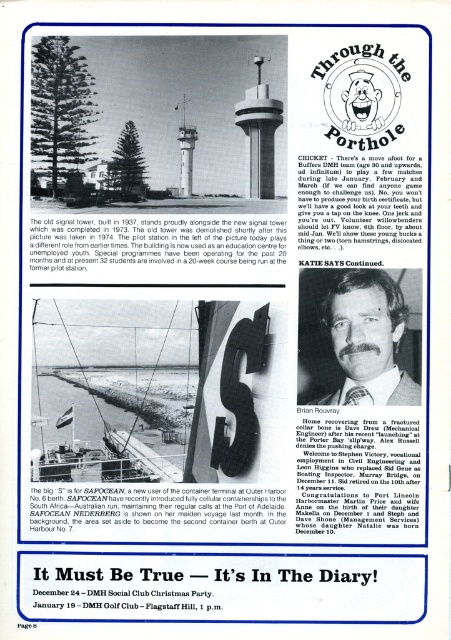
Does dark brown suit at center have a greater width compared to white concrete tower at center?

Correct, the width of dark brown suit at center exceeds that of white concrete tower at center.

Can you confirm if dark brown suit at center is positioned to the left of white concrete tower at center?

No, dark brown suit at center is not to the left of white concrete tower at center.

Where is `dark brown suit at center`? The height and width of the screenshot is (640, 451). dark brown suit at center is located at coordinates click(x=355, y=339).

In order to click on dark brown suit at center in this screenshot , I will do `click(355, 339)`.

Does smooth concrete tower at center have a lesser height compared to white concrete tower at center?

No, smooth concrete tower at center is not shorter than white concrete tower at center.

Based on the photo, is smooth concrete tower at center to the left of white concrete tower at center from the viewer's perspective?

No, smooth concrete tower at center is not to the left of white concrete tower at center.

Locate an element on the screen. The width and height of the screenshot is (451, 640). smooth concrete tower at center is located at coordinates (259, 132).

This screenshot has width=451, height=640. I want to click on smooth concrete tower at center, so click(259, 132).

The image size is (451, 640). Describe the element at coordinates (355, 339) in the screenshot. I see `dark brown suit at center` at that location.

Can you confirm if dark brown suit at center is bigger than smooth concrete tower at center?

Yes.

Is point (358, 352) positioned behind point (262, 84)?

No, it is not.

Locate an element on the screen. This screenshot has height=640, width=451. dark brown suit at center is located at coordinates (355, 339).